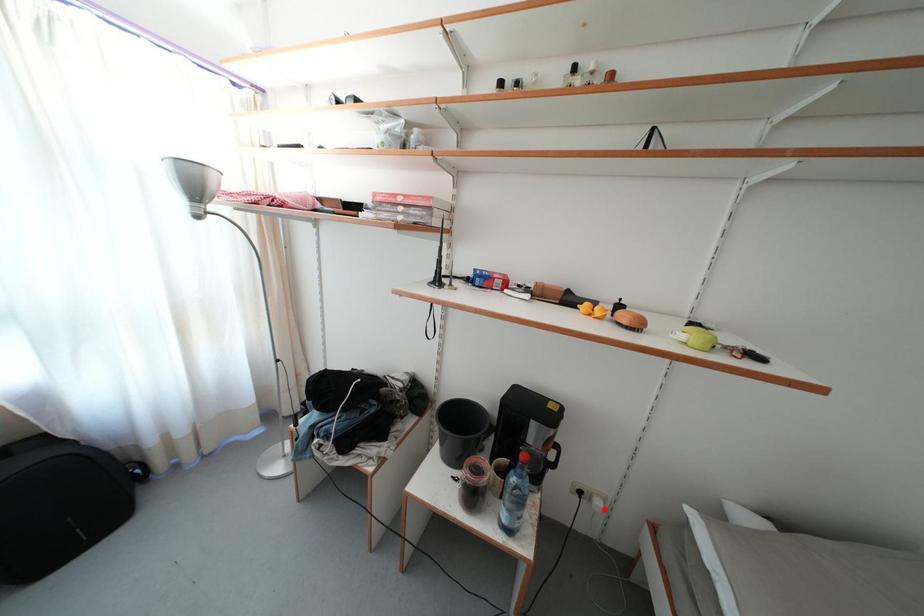
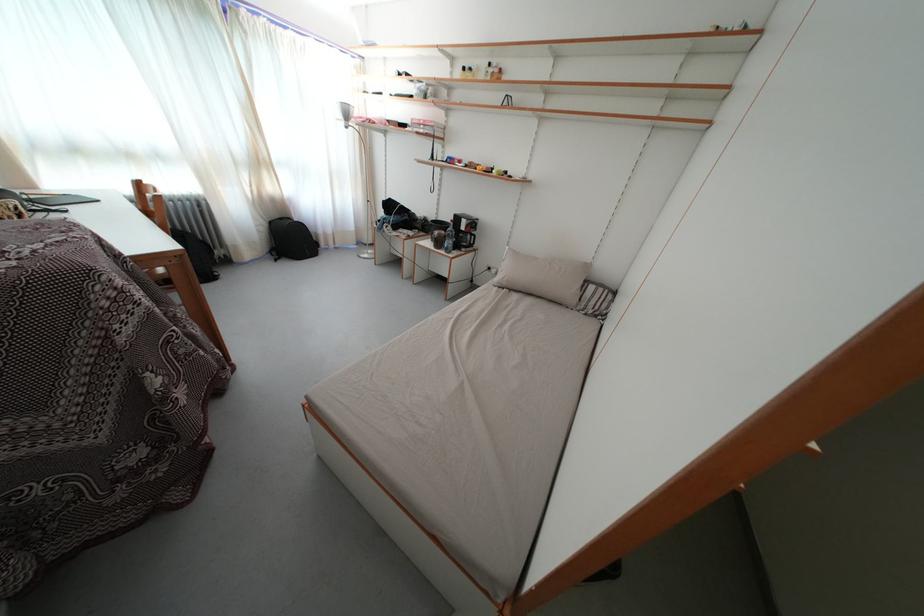
Question: I am providing you with two images of the same scene from different viewpoints. In image1, a red point is highlighted. Considering the same 3D point in image2, which of the following is correct?

Choices:
 (A) It is closer
 (B) It is farther

Answer: (B)